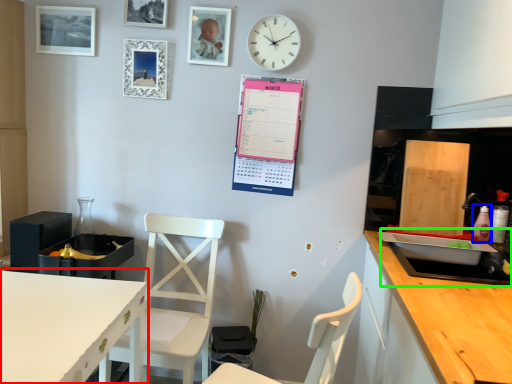
Question: Based on their relative distances, which object is farther from countertop (highlighted by a red box)? Choose from bottle (highlighted by a blue box) and sink (highlighted by a green box).

Choices:
 (A) bottle
 (B) sink

Answer: (A)